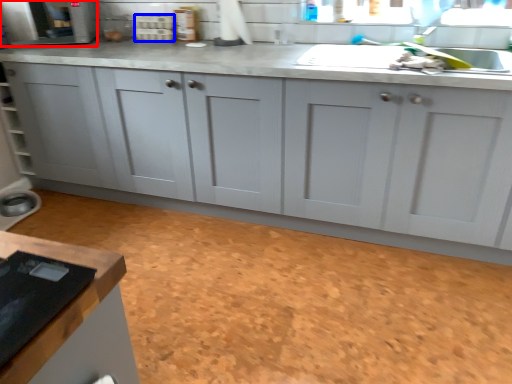
Question: Which of the following is the farthest to the observer, appliance (highlighted by a red box) or appliance (highlighted by a blue box)?

Choices:
 (A) appliance
 (B) appliance

Answer: (B)